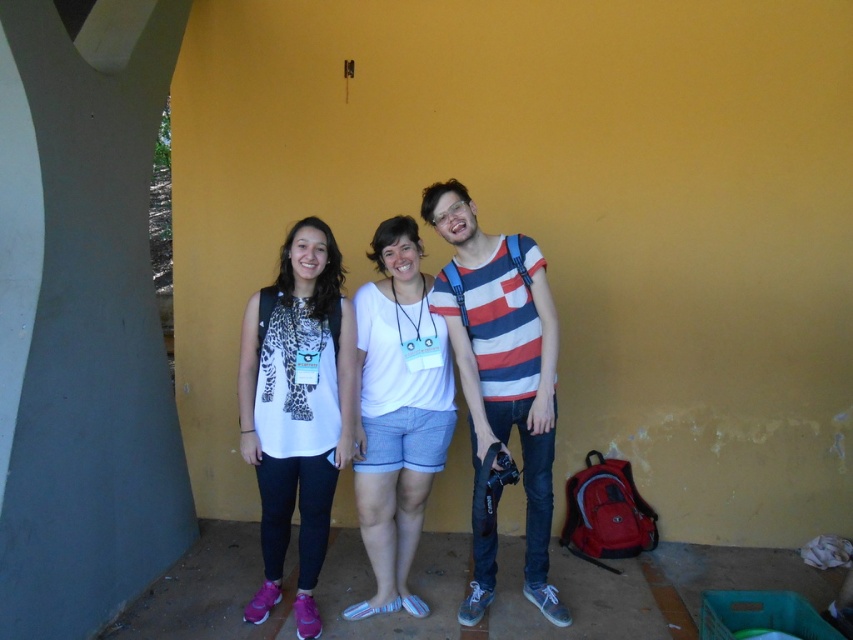
Who is lower down, white matte shirt at center or striped cotton shirt at center?

white matte shirt at center is below.

Is point (325, 497) farther from camera compared to point (506, 307)?

No, (325, 497) is in front of (506, 307).

Is point (352, 433) positioned behind point (524, 449)?

No.

The image size is (853, 640). In order to click on white matte shirt at center in this screenshot , I will do `click(297, 410)`.

Between white matte shirt at center and white cotton shirt at center, which one is positioned lower?

white matte shirt at center

Which of these two, white matte shirt at center or white cotton shirt at center, stands taller?

Standing taller between the two is white cotton shirt at center.

The image size is (853, 640). What are the coordinates of `white matte shirt at center` in the screenshot? It's located at (297, 410).

Does point (480, 236) lie in front of point (437, 376)?

Yes, it is in front of point (437, 376).

Is striped cotton shirt at center positioned before white cotton shirt at center?

Yes, striped cotton shirt at center is in front of white cotton shirt at center.

Is point (518, 392) more distant than point (401, 244)?

Yes, it is behind point (401, 244).

What are the coordinates of `striped cotton shirt at center` in the screenshot? It's located at pyautogui.click(x=500, y=378).